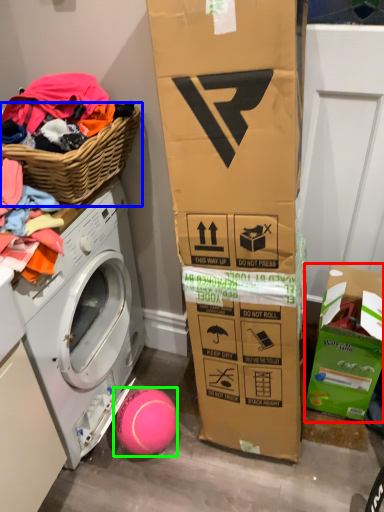
Question: Which is nearer to the cardboard box (highlighted by a red box)? basket (highlighted by a blue box) or ball (highlighted by a green box).

Choices:
 (A) basket
 (B) ball

Answer: (B)